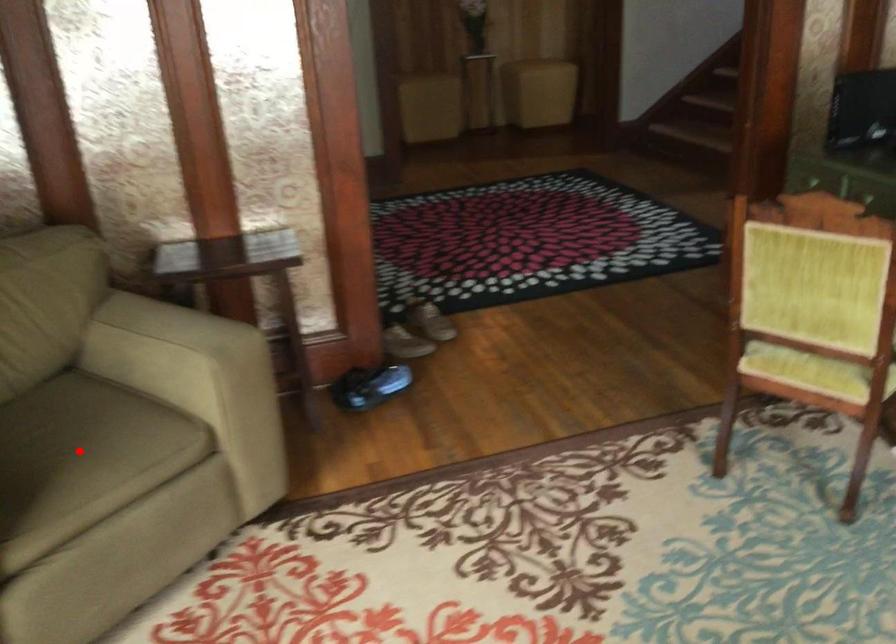
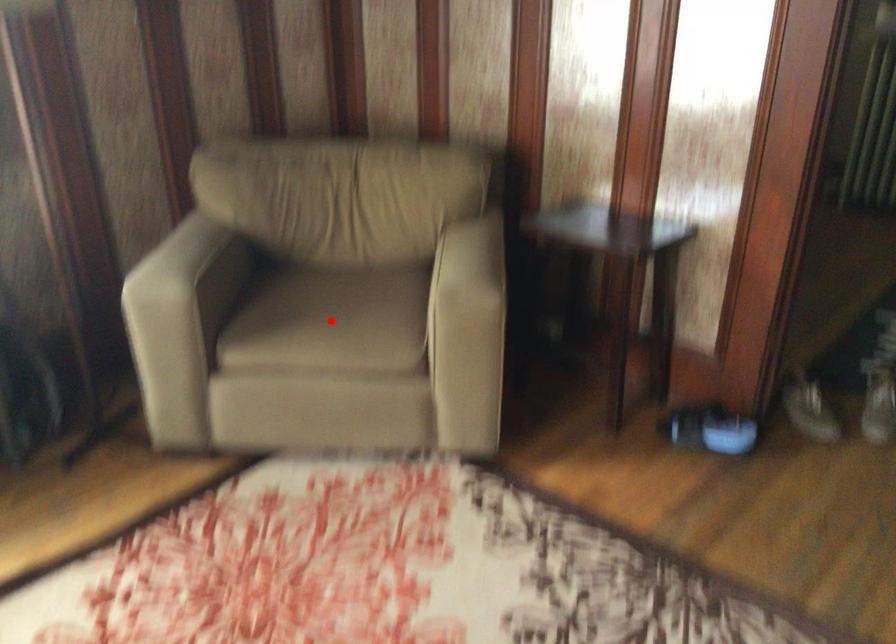
I am providing you with two images of the same scene from different viewpoints. A red point is marked on the first image and another point is marked on the second image. Do the highlighted points in image1 and image2 indicate the same real-world spot?

Yes